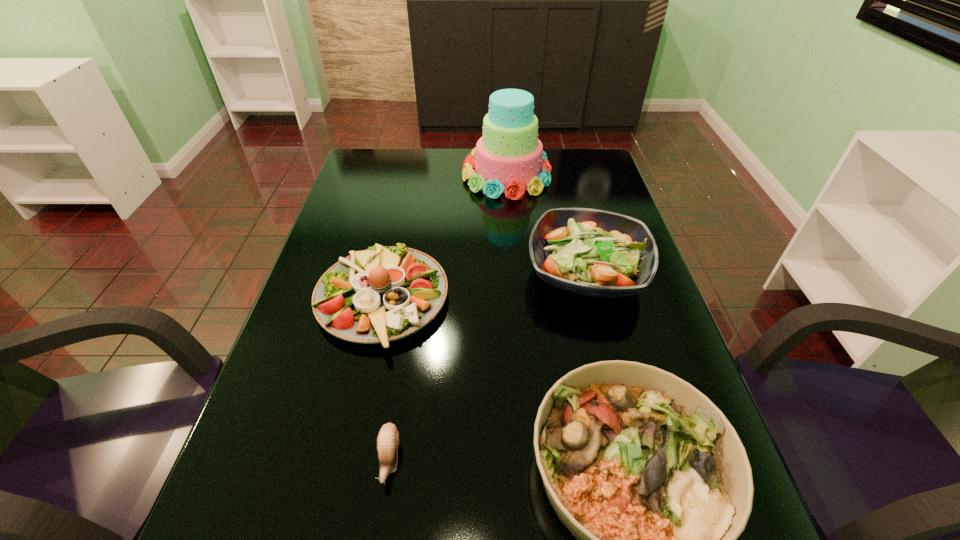
This screenshot has width=960, height=540. Find the location of `the farthest object`. the farthest object is located at coordinates (509, 158).

Locate an element on the screen. the tallest object is located at coordinates (509, 158).

This screenshot has width=960, height=540. Identify the location of the second tallest object. (591, 252).

Image resolution: width=960 pixels, height=540 pixels. Find the location of `the leftmost salad plate`. the leftmost salad plate is located at coordinates (382, 294).

Where is `the shortest object`? The height and width of the screenshot is (540, 960). the shortest object is located at coordinates (388, 438).

What are the coordinates of `vacant space situated on the front of the farthest object` in the screenshot? It's located at (510, 210).

Locate an element on the screen. Image resolution: width=960 pixels, height=540 pixels. free location located on the left of the tallest salad plate is located at coordinates (416, 272).

The width and height of the screenshot is (960, 540). In order to click on vacant area located on the right of the leftmost salad plate in this screenshot , I will do `click(563, 301)`.

The height and width of the screenshot is (540, 960). I want to click on free region located on the front-facing side of the shortest object, so click(379, 529).

Locate an element on the screen. object that is positioned at the far edge is located at coordinates [x=509, y=158].